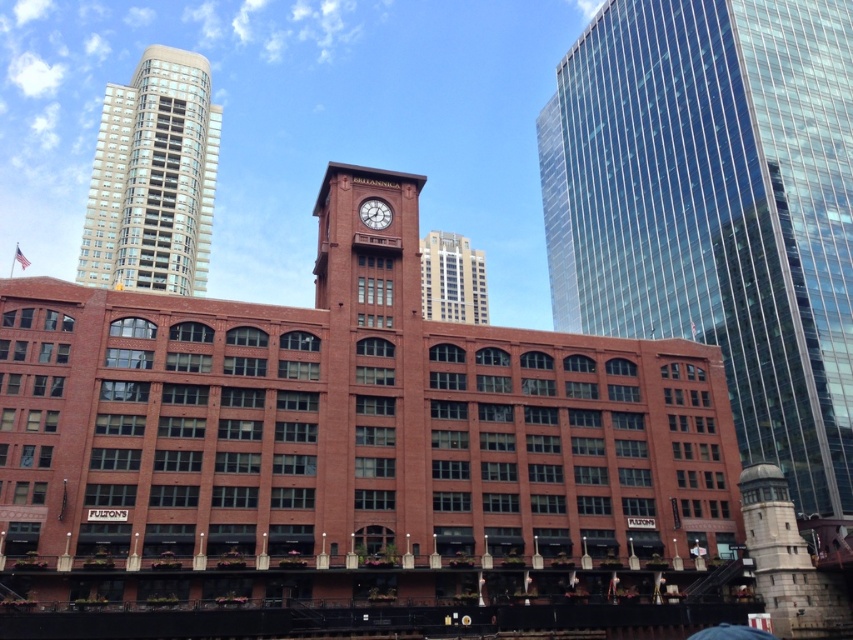
Question: Which point is closer to the camera taking this photo?

Choices:
 (A) (802, 499)
 (B) (363, 202)
 (C) (138, 209)

Answer: (B)

Question: Can you confirm if beige glassy building at upper left is positioned to the left of glassy reflective skyscraper at upper center?

Choices:
 (A) no
 (B) yes

Answer: (B)

Question: Which point is closer to the camera taking this photo?

Choices:
 (A) click(213, 184)
 (B) click(390, 216)

Answer: (B)

Question: Can you confirm if beige glassy building at upper left is smaller than matte red clock at center?

Choices:
 (A) yes
 (B) no

Answer: (B)

Question: Does glassy reflective skyscraper at upper right come behind beige glassy building at upper left?

Choices:
 (A) yes
 (B) no

Answer: (B)

Question: Which object appears farthest from the camera in this image?

Choices:
 (A) glassy reflective skyscraper at upper center
 (B) glassy reflective skyscraper at upper right

Answer: (B)